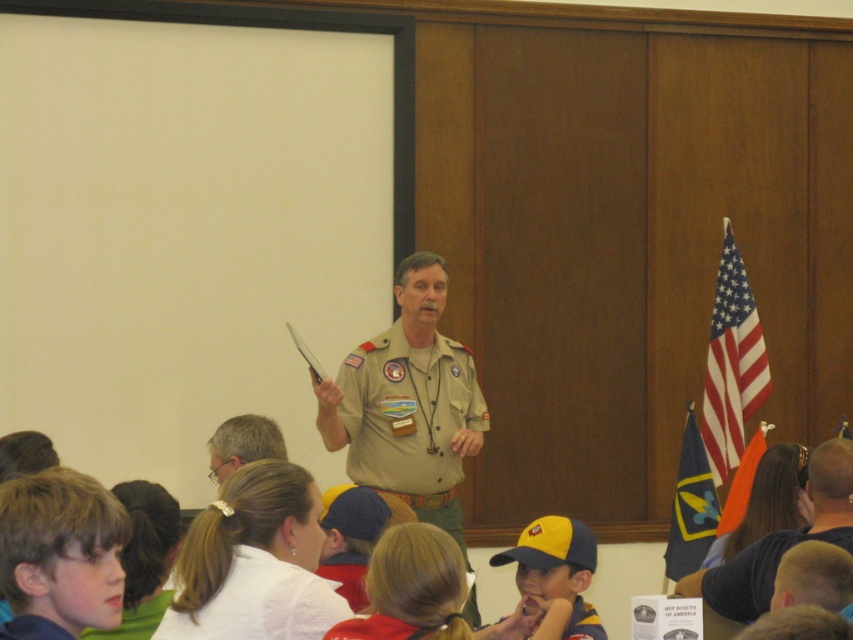
You are a photographer trying to capture the speaker in the center. You notice the white silky hair at center and the yellow fabric cap at lower right. Which object should you focus on if you want to capture something larger in the frame?

The white silky hair at center is bigger than the yellow fabric cap at lower right, so you should focus on the white silky hair at center to capture something larger in the frame.

You are a photographer positioned at the back of the room. You want to take a photo that includes both the khaki uniform at center and the yellow fabric cap at lower right. What is the minimum distance you need to move backward to ensure both are in frame?

The khaki uniform at center and the yellow fabric cap at lower right are 1.34 meters apart. To include both in the frame, you need to move back at least 1.34 meters to ensure the camera can capture the entire distance between them.

In the scene shown: You are a photographer trying to capture a clear shot of both the blonde hair at lower left and the yellow fabric cap at lower right. Based on their positions, which object is closer to the camera?

The yellow fabric cap at lower right is closer to the camera since it is shorter than the blonde hair at lower left.